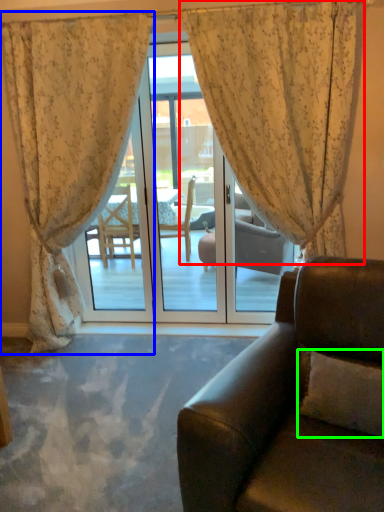
Question: Which is nearer to the curtain (highlighted by a red box)? curtain (highlighted by a blue box) or pillow (highlighted by a green box).

Choices:
 (A) curtain
 (B) pillow

Answer: (A)